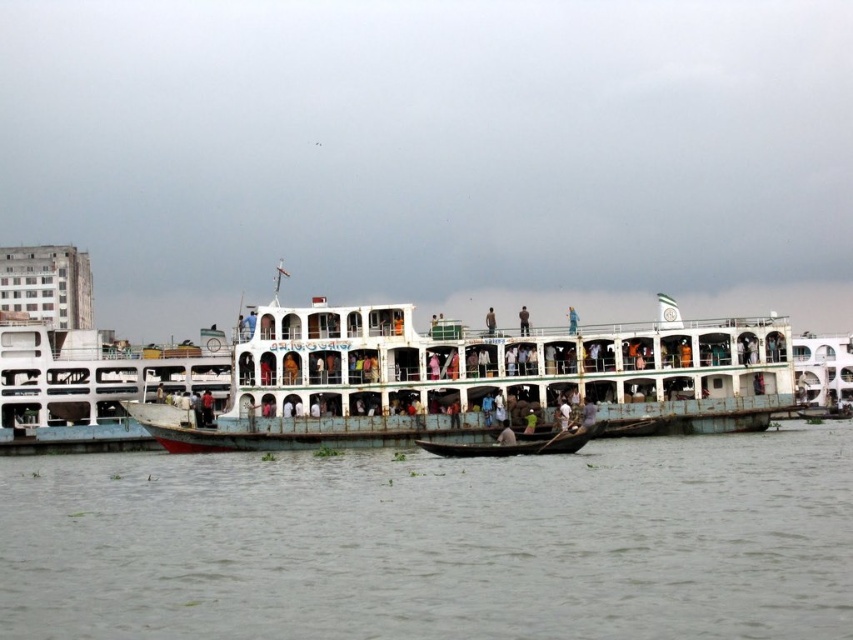
Between wooden boat at center and dark blue fabric at upper center, which one has less height?

Standing shorter between the two is wooden boat at center.

Who is more forward, [486,451] or [521,310]?

Point [486,451]

Locate an element on the screen. The width and height of the screenshot is (853, 640). wooden boat at center is located at coordinates (519, 444).

Locate an element on the screen. wooden boat at center is located at coordinates (519, 444).

Is white painted metal ferry at center behind dark blue fabric at upper center?

No.

Based on the photo, can you confirm if white painted metal ferry at center is positioned above dark blue fabric at upper center?

Indeed, white painted metal ferry at center is positioned over dark blue fabric at upper center.

Does point (396, 396) come in front of point (525, 323)?

Yes.

What are the coordinates of `white painted metal ferry at center` in the screenshot? It's located at (479, 378).

Is point (679, 353) farther from camera compared to point (486, 312)?

No, (679, 353) is closer to viewer.

Can you confirm if white painted metal ferry at center is bigger than light blue fabric shirt at center?

Yes, white painted metal ferry at center is bigger than light blue fabric shirt at center.

Describe the element at coordinates (479, 378) in the screenshot. I see `white painted metal ferry at center` at that location.

Where is `white painted metal ferry at center`? Image resolution: width=853 pixels, height=640 pixels. white painted metal ferry at center is located at coordinates (479, 378).